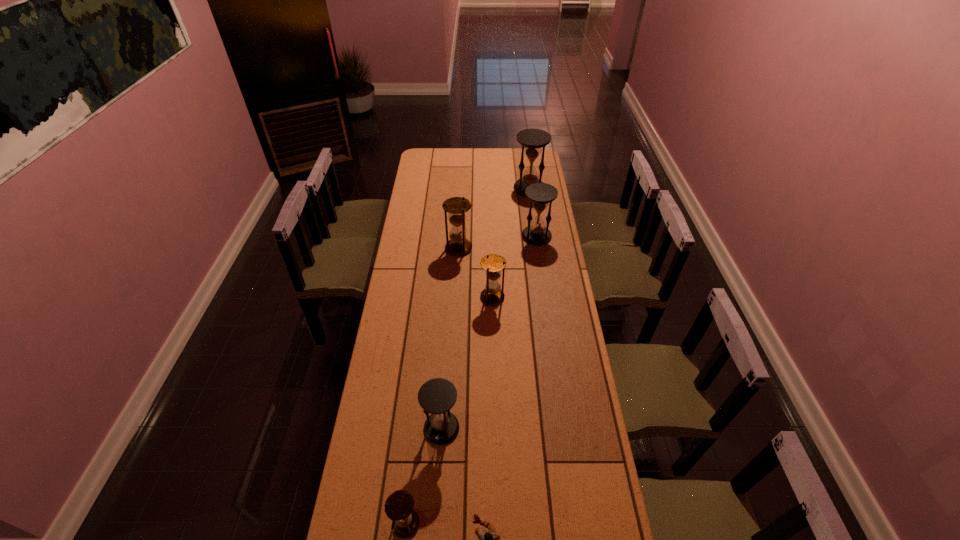
Where is `free space at the right edge of the desktop`? free space at the right edge of the desktop is located at coordinates (559, 323).

I want to click on free space at the far right corner, so click(527, 158).

This screenshot has height=540, width=960. Identify the location of free spot between the nearest brown hourglass and the nearest black hourglass. (423, 476).

Image resolution: width=960 pixels, height=540 pixels. In order to click on free space that is in between the fifth farthest hourglass and the nearest hourglass in this screenshot , I will do `click(423, 476)`.

The width and height of the screenshot is (960, 540). In order to click on free space between the leftmost brown hourglass and the farthest object in this screenshot , I will do `click(468, 356)`.

This screenshot has height=540, width=960. In order to click on free space between the second biggest brown hourglass and the second smallest black hourglass in this screenshot , I will do `click(515, 267)`.

Where is `vacant area that lies between the second smallest black hourglass and the second farthest brown hourglass`? vacant area that lies between the second smallest black hourglass and the second farthest brown hourglass is located at coordinates (515, 267).

Identify the location of object that stands as the third closest to the third hourglass from right to left. This screenshot has width=960, height=540. (437, 396).

Select which object appears as the fourth closest to the second farthest black hourglass. Please provide its 2D coordinates. Your answer should be formatted as a tuple, i.e. [(x, y)], where the tuple contains the x and y coordinates of a point satisfying the conditions above.

[(437, 396)]

Identify which hourglass is the second closest to the tallest object. Please provide its 2D coordinates. Your answer should be formatted as a tuple, i.e. [(x, y)], where the tuple contains the x and y coordinates of a point satisfying the conditions above.

[(456, 206)]